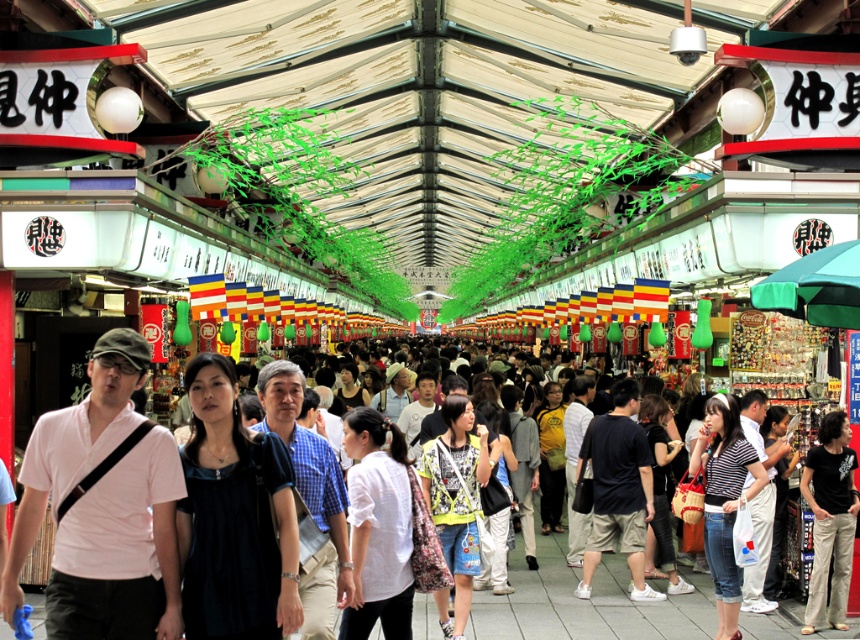
Who is more distant from viewer, (717, 442) or (828, 602)?

Point (828, 602)

Is point (722, 520) positioned in front of point (838, 566)?

That is True.

At what (x,y) coordinates should I click in order to perform the action: click on striped cotton shirt at center. Please return your answer as a coordinate pair (x, y). Looking at the image, I should click on (723, 499).

Can you confirm if white matte shirt at center is positioned to the right of striped cotton shirt at center?

No, white matte shirt at center is not to the right of striped cotton shirt at center.

Does white matte shirt at center have a larger size compared to striped cotton shirt at center?

No, white matte shirt at center is not bigger than striped cotton shirt at center.

Is point (349, 612) farther from viewer compared to point (711, 500)?

No, (349, 612) is in front of (711, 500).

At what (x,y) coordinates should I click in order to perform the action: click on white matte shirt at center. Please return your answer as a coordinate pair (x, y). The height and width of the screenshot is (640, 860). Looking at the image, I should click on (378, 528).

Who is more forward, [247,620] or [527,474]?

Positioned in front is point [247,620].

Locate an element on the screen. dark blue fabric shirt at center is located at coordinates (232, 516).